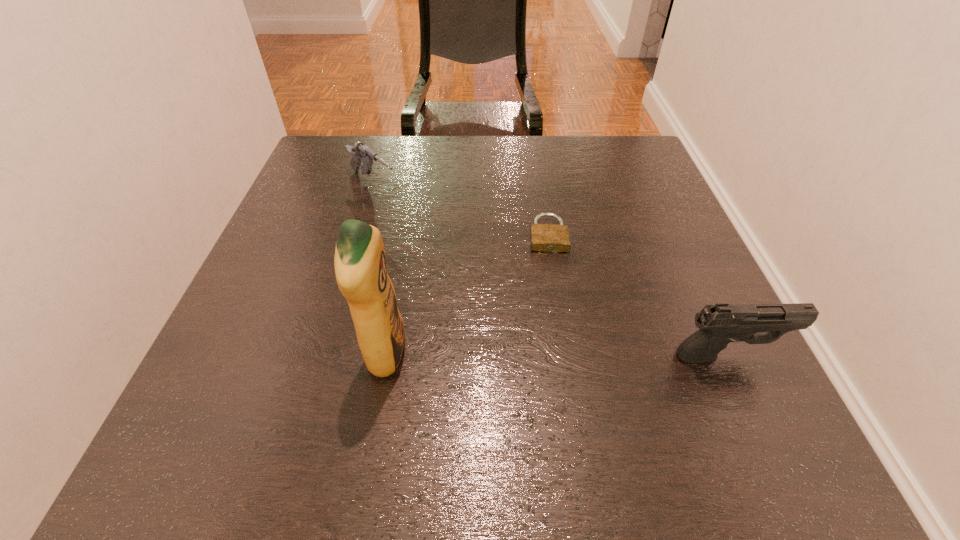
You are a GUI agent. You are given a task and a screenshot of the screen. Output one action in this format:
    pyautogui.click(x=<x>, y=<y>)
    Task: Click on the object that is at the far left corner
    
    Given the screenshot: What is the action you would take?
    pyautogui.click(x=360, y=152)

The height and width of the screenshot is (540, 960). I want to click on object that is at the near right corner, so click(x=720, y=324).

Locate an element on the screen. The width and height of the screenshot is (960, 540). free spot at the far edge of the desktop is located at coordinates (480, 148).

Locate an element on the screen. vacant space at the near edge is located at coordinates (592, 403).

Image resolution: width=960 pixels, height=540 pixels. In the image, there is a desktop. Identify the location of vacant space at the left edge. (299, 216).

Find the location of `vacant space at the right edge of the desktop`. vacant space at the right edge of the desktop is located at coordinates (613, 228).

In the image, there is a desktop. Identify the location of vacant area at the near right corner. (741, 396).

The height and width of the screenshot is (540, 960). What are the coordinates of `unoccupied position between the pistol and the padlock` in the screenshot? It's located at (637, 295).

Where is `free space between the second tallest object and the shortest object`? This screenshot has width=960, height=540. free space between the second tallest object and the shortest object is located at coordinates (637, 295).

Where is `vacant space that is in between the second tallest object and the leftmost object`? vacant space that is in between the second tallest object and the leftmost object is located at coordinates (550, 271).